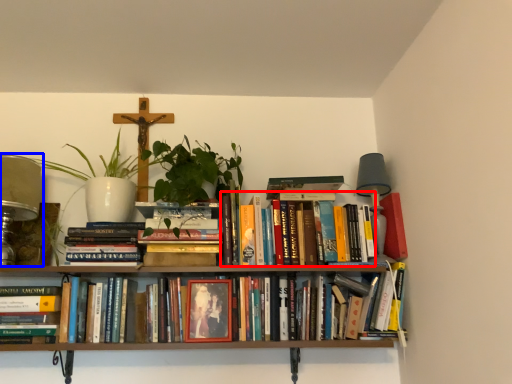
Question: Which point is closer to the camera, book (highlighted by a red box) or table lamp (highlighted by a blue box)?

Choices:
 (A) book
 (B) table lamp

Answer: (B)